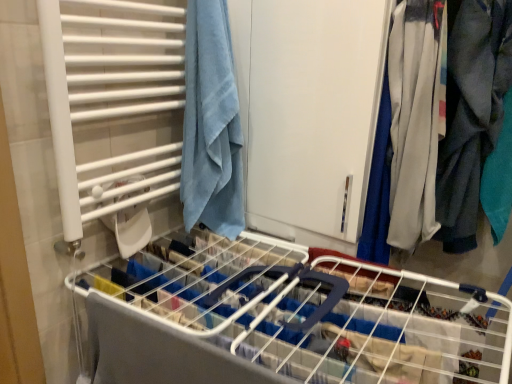
Identify the location of blue cotton towel at upper left. (211, 124).

Measure the distance between white matte cabinet at center and camera.

white matte cabinet at center and camera are 1.08 meters apart from each other.

In order to face gray cotton pants at right, should I rotate leftwards or rightwards?

Turn right by 27.494 degrees to look at gray cotton pants at right.

Identify the location of blue cotton towel at upper left. The width and height of the screenshot is (512, 384). (211, 124).

Based on the photo, from their relative heights in the image, would you say white matte cabinet at center is taller or shorter than white plastic bed frame at center?

In the image, white matte cabinet at center appears to be taller than white plastic bed frame at center.

Is the position of white matte cabinet at center less distant than that of white plastic bed frame at center?

No.

Between white matte cabinet at center and white plastic bed frame at center, which one has smaller size?

white matte cabinet at center.

In the scene shown: Between white matte cabinet at center and white plastic bed frame at center, which one has smaller width?

white matte cabinet at center.

At what (x,y) coordinates should I click in order to perform the action: click on screen door lying in front of the blue cotton towel at upper left. Please return your answer as a coordinate pair (x, y). This screenshot has height=384, width=512. Looking at the image, I should click on (310, 111).

Are blue cotton towel at upper left and white matte cabinet at center far apart?

That's not correct — blue cotton towel at upper left is a little close to white matte cabinet at center.

From a real-world perspective, is blue cotton towel at upper left below white matte cabinet at center?

Yes.

In terms of size, does blue cotton towel at upper left appear bigger or smaller than white matte cabinet at center?

Clearly, blue cotton towel at upper left is smaller in size than white matte cabinet at center.

From the image's perspective, is white matte cabinet at center located above or below blue cotton towel at upper left?

Clearly, from the image's perspective, white matte cabinet at center is above blue cotton towel at upper left.

Is point (298, 59) less distant than point (187, 174)?

Yes, point (298, 59) is closer to viewer.

Is white matte cabinet at center located outside blue cotton towel at upper left?

white matte cabinet at center lies outside blue cotton towel at upper left's area.

Who is smaller, white plastic bed frame at center or white matte cabinet at center?

white matte cabinet at center.

In the scene shown: Is white plastic bed frame at center looking in the opposite direction of white matte cabinet at center?

No, white plastic bed frame at center's orientation is not away from white matte cabinet at center.

This screenshot has width=512, height=384. Identify the location of bed frame that appears below the white matte cabinet at center (from the image's perspective). (281, 320).

From a real-world perspective, is white plastic bed frame at center above or below white matte cabinet at center?

In terms of real-world spatial position, white plastic bed frame at center is below white matte cabinet at center.

Considering the points (223, 302) and (479, 25), which point is in front, point (223, 302) or point (479, 25)?

The point (223, 302) is closer to the camera.

Can gray cotton pants at right be found inside white plastic bed frame at center?

Actually, gray cotton pants at right is outside white plastic bed frame at center.

Does white plastic bed frame at center lie in front of gray cotton pants at right?

That is True.

Considering the relative sizes of white plastic bed frame at center and gray cotton pants at right in the image provided, is white plastic bed frame at center smaller than gray cotton pants at right?

No.

Could you tell me if white matte cabinet at center is facing gray cotton pants at right?

No, white matte cabinet at center does not turn towards gray cotton pants at right.

Between point (329, 157) and point (466, 88), which one is positioned in front?

The point (466, 88) is more forward.

Does white matte cabinet at center have a smaller size compared to gray cotton pants at right?

Incorrect, white matte cabinet at center is not smaller in size than gray cotton pants at right.

From the picture: From a real-world perspective, is white matte cabinet at center positioned above or below gray cotton pants at right?

white matte cabinet at center is above gray cotton pants at right.

Which of these two, blue cotton towel at upper left or gray cotton pants at right, is wider?

blue cotton towel at upper left is wider.

From the image's perspective, is blue cotton towel at upper left on gray cotton pants at right?

Correct, blue cotton towel at upper left appears higher than gray cotton pants at right in the image.

Is blue cotton towel at upper left turned away from gray cotton pants at right?

No.

Can you confirm if blue cotton towel at upper left is shorter than gray cotton pants at right?

Yes, blue cotton towel at upper left is shorter than gray cotton pants at right.

Where is `bed frame that is on the left side of white matte cabinet at center`? bed frame that is on the left side of white matte cabinet at center is located at coordinates (281, 320).

In the image, there is a blue cotton towel at upper left. At what (x,y) coordinates should I click in order to perform the action: click on screen door above it (from the image's perspective). Please return your answer as a coordinate pair (x, y). Image resolution: width=512 pixels, height=384 pixels. Looking at the image, I should click on (310, 111).

Looking at the image, which one is located closer to gray cotton pants at right, blue cotton towel at upper left or white matte cabinet at center?

Based on the image, white matte cabinet at center appears to be nearer to gray cotton pants at right.

When comparing their distances from white plastic bed frame at center, does gray cotton pants at right or white matte cabinet at center seem closer?

The object closer to white plastic bed frame at center is white matte cabinet at center.

Which object lies further to the anchor point blue cotton towel at upper left, white matte cabinet at center or white plastic bed frame at center?

Among the two, white plastic bed frame at center is located further to blue cotton towel at upper left.

Estimate the real-world distances between objects in this image. Which object is further from gray cotton pants at right, white plastic bed frame at center or blue cotton towel at upper left?

Based on the image, blue cotton towel at upper left appears to be further to gray cotton pants at right.

Consider the image. Estimate the real-world distances between objects in this image. Which object is closer to blue cotton towel at upper left, white plastic bed frame at center or gray cotton pants at right?

white plastic bed frame at center is closer to blue cotton towel at upper left.

When comparing their distances from gray cotton pants at right, does blue cotton towel at upper left or white plastic bed frame at center seem closer?

Based on the image, white plastic bed frame at center appears to be nearer to gray cotton pants at right.

Looking at the image, which one is located closer to blue cotton towel at upper left, gray cotton pants at right or white plastic bed frame at center?

white plastic bed frame at center lies closer to blue cotton towel at upper left than the other object.

In the scene shown: Which object lies further to the anchor point white plastic bed frame at center, blue cotton towel at upper left or gray cotton pants at right?

The object further to white plastic bed frame at center is gray cotton pants at right.

This screenshot has height=384, width=512. What are the coordinates of `clothing between blue cotton towel at upper left and white plastic bed frame at center in the vertical direction` in the screenshot? It's located at (471, 115).

Where is `clothing between white matte cabinet at center and white plastic bed frame at center vertically`? clothing between white matte cabinet at center and white plastic bed frame at center vertically is located at coordinates (471, 115).

You are a GUI agent. You are given a task and a screenshot of the screen. Output one action in this format:
    pyautogui.click(x=<x>, y=<y>)
    Task: Click on the towel between white matte cabinet at center and white plastic bed frame at center in the up-down direction
    This screenshot has height=384, width=512.
    Given the screenshot: What is the action you would take?
    pyautogui.click(x=211, y=124)

You are a GUI agent. You are given a task and a screenshot of the screen. Output one action in this format:
    pyautogui.click(x=<x>, y=<y>)
    Task: Click on the screen door between blue cotton towel at upper left and gray cotton pants at right from left to right
    The height and width of the screenshot is (384, 512).
    Given the screenshot: What is the action you would take?
    pyautogui.click(x=310, y=111)